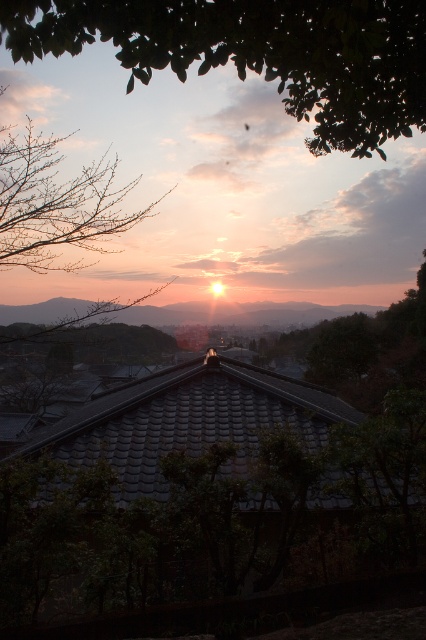
Which is below, green leafy tree at upper center or bare branches at upper left?

bare branches at upper left

Describe the element at coordinates (258, 52) in the screenshot. I see `green leafy tree at upper center` at that location.

At what (x,y) coordinates should I click in order to perform the action: click on green leafy tree at upper center. Please return your answer as a coordinate pair (x, y). The width and height of the screenshot is (426, 640). Looking at the image, I should click on (258, 52).